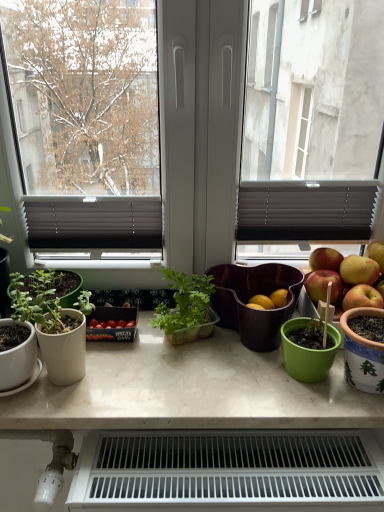
Where is `empty space that is ontop of white marble table at center`? This screenshot has height=512, width=384. empty space that is ontop of white marble table at center is located at coordinates (185, 365).